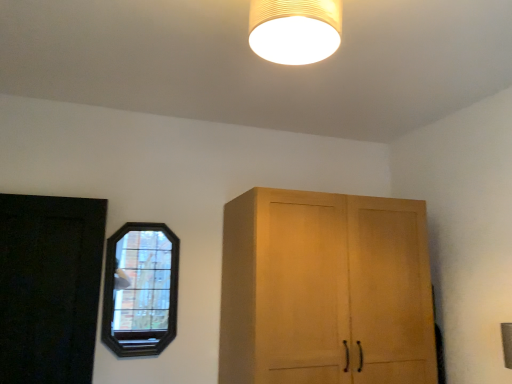
Question: Is black matte door at left thinner than dark wood stained window at left?

Choices:
 (A) yes
 (B) no

Answer: (B)

Question: Is black matte door at left facing away from dark wood stained window at left?

Choices:
 (A) no
 (B) yes

Answer: (A)

Question: Is black matte door at left at the left side of dark wood stained window at left?

Choices:
 (A) yes
 (B) no

Answer: (A)

Question: Is the position of black matte door at left less distant than that of dark wood stained window at left?

Choices:
 (A) no
 (B) yes

Answer: (B)

Question: Is black matte door at left oriented towards dark wood stained window at left?

Choices:
 (A) no
 (B) yes

Answer: (A)

Question: Is matte beige lampshade at upper center in front of or behind dark wood stained window at left in the image?

Choices:
 (A) front
 (B) behind

Answer: (A)

Question: In terms of size, does matte beige lampshade at upper center appear bigger or smaller than dark wood stained window at left?

Choices:
 (A) big
 (B) small

Answer: (B)

Question: Would you say matte beige lampshade at upper center is to the left or to the right of dark wood stained window at left in the picture?

Choices:
 (A) right
 (B) left

Answer: (A)

Question: Considering the positions of matte beige lampshade at upper center and dark wood stained window at left in the image, is matte beige lampshade at upper center taller or shorter than dark wood stained window at left?

Choices:
 (A) short
 (B) tall

Answer: (A)

Question: Considering the positions of dark wood stained window at left and matte beige lampshade at upper center in the image, is dark wood stained window at left wider or thinner than matte beige lampshade at upper center?

Choices:
 (A) thin
 (B) wide

Answer: (A)

Question: Based on their positions, is dark wood stained window at left located to the left or right of matte beige lampshade at upper center?

Choices:
 (A) right
 (B) left

Answer: (B)

Question: Is dark wood stained window at left inside or outside of matte beige lampshade at upper center?

Choices:
 (A) outside
 (B) inside

Answer: (A)

Question: Does point (105, 261) appear closer or farther from the camera than point (306, 38)?

Choices:
 (A) farther
 (B) closer

Answer: (A)

Question: Based on their positions, is dark wood stained window at left located to the left or right of black matte door at left?

Choices:
 (A) left
 (B) right

Answer: (B)

Question: From the image's perspective, relative to black matte door at left, is dark wood stained window at left above or below?

Choices:
 (A) above
 (B) below

Answer: (B)